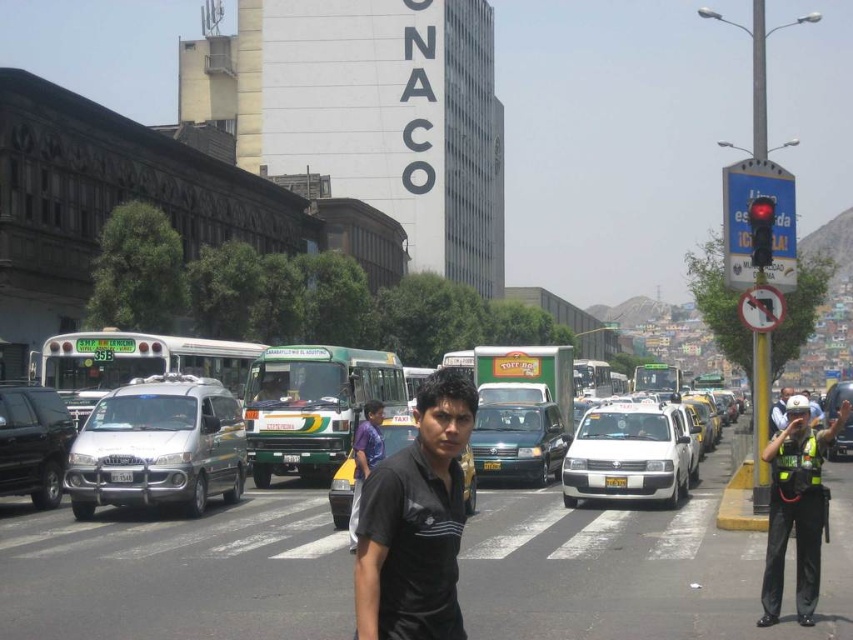
Is point (9, 451) closer to camera compared to point (791, 388)?

Yes, it is in front of point (791, 388).

This screenshot has height=640, width=853. What do you see at coordinates (33, 442) in the screenshot?
I see `shiny silver suv at center-left` at bounding box center [33, 442].

Where is `shiny silver suv at center-left`? shiny silver suv at center-left is located at coordinates (33, 442).

Who is taller, metallic silver van at center or metallic silver sedan at center?

metallic silver van at center is taller.

Which is behind, point (294, 582) or point (541, 484)?

The point (541, 484) is more distant.

Find the location of a particular element. metallic silver van at center is located at coordinates (637, 564).

Can you confirm if metallic silver sedan at center is shorter than black shirt at center?

Yes, metallic silver sedan at center is shorter than black shirt at center.

The height and width of the screenshot is (640, 853). In order to click on metallic silver sedan at center in this screenshot , I will do `click(518, 442)`.